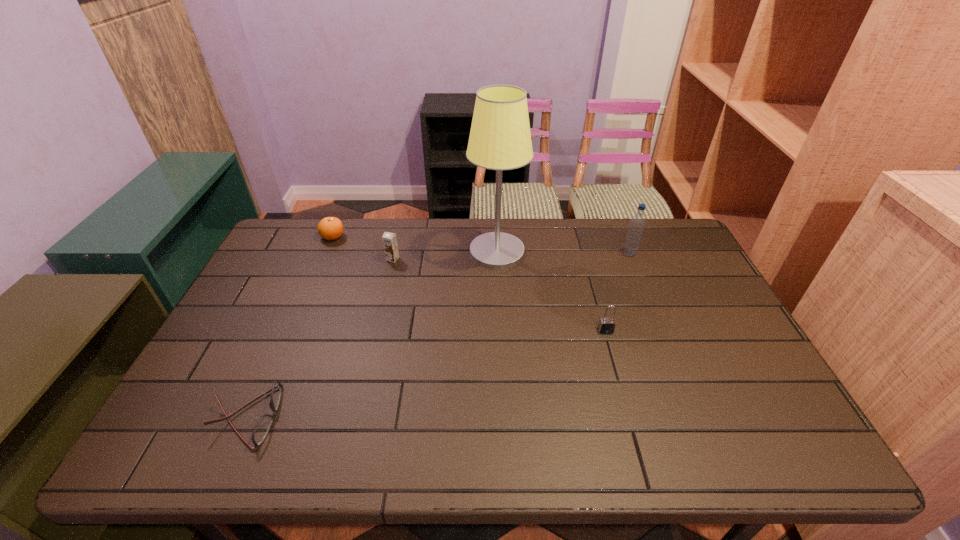
This screenshot has width=960, height=540. Find the location of `table lamp`. table lamp is located at coordinates (500, 139).

The width and height of the screenshot is (960, 540). In order to click on the third object from right to left in this screenshot , I will do coord(500,139).

This screenshot has width=960, height=540. I want to click on the rightmost object, so click(636, 227).

Find the location of a particular element. Image resolution: width=960 pixels, height=540 pixels. the second tallest object is located at coordinates (636, 227).

At what (x,y) coordinates should I click in order to perform the action: click on chocolate milk. Please return your answer as a coordinate pair (x, y). This screenshot has height=540, width=960. Looking at the image, I should click on (389, 239).

Where is `padlock`? The width and height of the screenshot is (960, 540). padlock is located at coordinates (606, 325).

At what (x,y) coordinates should I click in order to perform the action: click on the second object from right to left. Please return your answer as a coordinate pair (x, y). Looking at the image, I should click on (606, 325).

Identify the location of the second shortest object. (329, 228).

The image size is (960, 540). I want to click on spectacles, so click(x=261, y=430).

This screenshot has width=960, height=540. Identify the location of the shortest object. (261, 430).